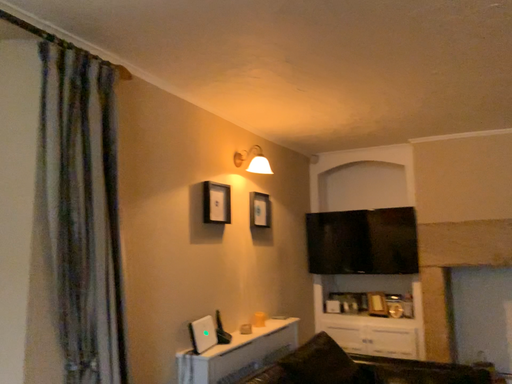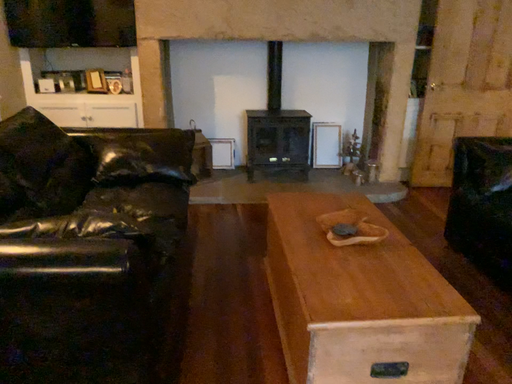
Question: Which way did the camera rotate in the video?

Choices:
 (A) rotated left
 (B) rotated right

Answer: (B)